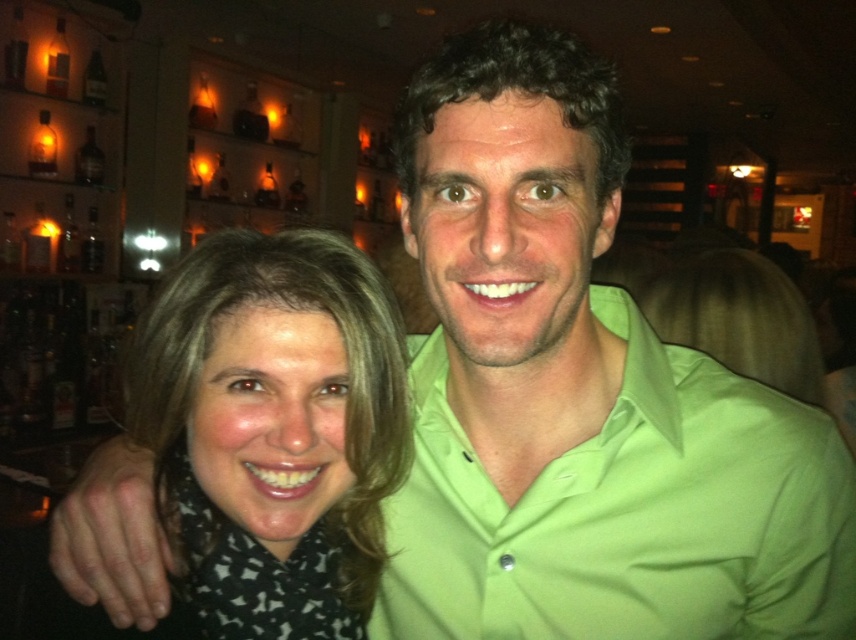
You are a photographer setting up for a group photo in a bar. You notice the lime green polo shirt at center and the matte black scarf at left. Which item should you adjust your camera focus on if you want to ensure the larger object is in sharp focus?

The lime green polo shirt at center is bigger than the matte black scarf at left, so you should adjust the camera focus on the lime green polo shirt at center to ensure the larger object is in sharp focus.

You are a photographer trying to focus on the lime green polo shirt at center and the matte black scarf at left. Which object should you adjust your camera focus to first if you want to capture both clearly in one shot?

The lime green polo shirt at center should be focused on first because it is positioned under the matte black scarf at left, meaning it is closer to the camera. By focusing on the closer object first, you can ensure both are in focus using depth of field.